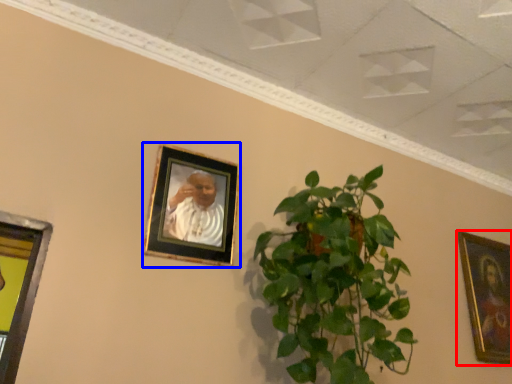
Question: Which object appears farthest to the camera in this image, picture frame (highlighted by a red box) or picture frame (highlighted by a blue box)?

Choices:
 (A) picture frame
 (B) picture frame

Answer: (A)